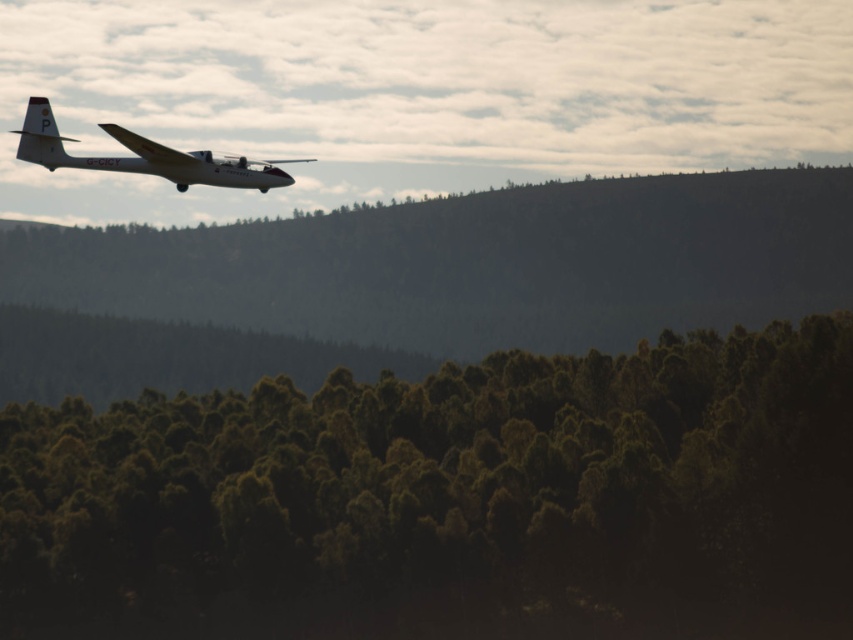
You are a pilot planning to land your plane on a runway that is hidden behind the green textured hillside at upper center. Based on the scene, can you estimate whether the matte white airplane at upper left is closer to the hillside or farther away?

The green textured hillside at upper center is larger in size than the matte white airplane at upper left, which suggests that the matte white airplane at upper left is farther away from the observer compared to the hillside. Therefore, the matte white airplane at upper left is farther away from the green textured hillside at upper center.

You are a drone operator trying to navigate through the dense forest below the aircraft. The point marked as point (445, 497) is part of the green textured trees at lower center. Can you confirm if this point is part of the trees?

Yes, the point (445, 497) is part of the green textured trees at lower center as stated in the description.